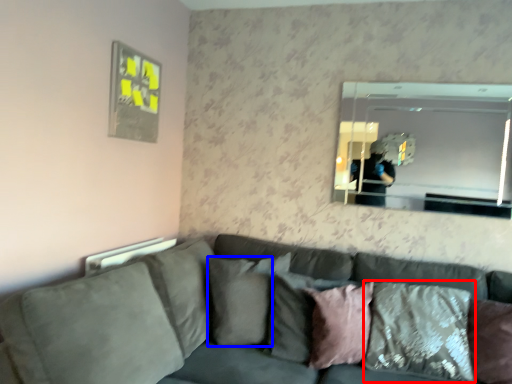
Question: Among these objects, which one is nearest to the camera, pillow (highlighted by a red box) or pillow (highlighted by a blue box)?

Choices:
 (A) pillow
 (B) pillow

Answer: (A)